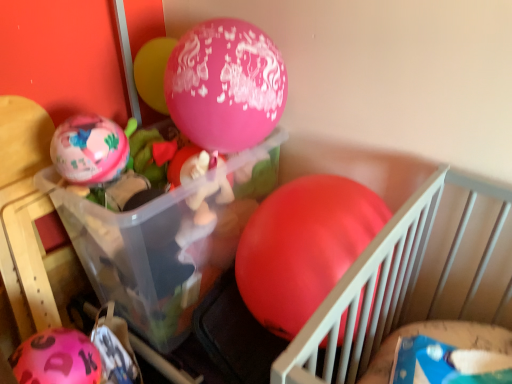
Question: From the image's perspective, does pink matte balloon at lower left, the fourth balloon from the right, appear higher than transparent plastic container at center?

Choices:
 (A) yes
 (B) no

Answer: (B)

Question: From a real-world perspective, is pink matte balloon at lower left, the 1th balloon positioned from the left, physically below transparent plastic container at center?

Choices:
 (A) yes
 (B) no

Answer: (A)

Question: Considering the relative positions of pink matte balloon at lower left, the fourth balloon from the right, and transparent plastic container at center in the image provided, is pink matte balloon at lower left, the fourth balloon from the right, in front of transparent plastic container at center?

Choices:
 (A) yes
 (B) no

Answer: (A)

Question: Does pink matte balloon at lower left, the fourth balloon from the right, appear on the right side of transparent plastic container at center?

Choices:
 (A) no
 (B) yes

Answer: (A)

Question: Is pink matte balloon at lower left, the 1th balloon positioned from the left, to the left of transparent plastic container at center from the viewer's perspective?

Choices:
 (A) no
 (B) yes

Answer: (B)

Question: In the image, is matte pink balloon at left, which is the third balloon from right to left, on the left side or the right side of transparent plastic container at center?

Choices:
 (A) right
 (B) left

Answer: (B)

Question: In the image, is matte pink balloon at left, placed as the second balloon when sorted from left to right, positioned in front of or behind transparent plastic container at center?

Choices:
 (A) behind
 (B) front

Answer: (A)

Question: Is matte pink balloon at left, which is the third balloon from right to left, taller or shorter than transparent plastic container at center?

Choices:
 (A) tall
 (B) short

Answer: (B)

Question: Considering the positions of point (100, 119) and point (194, 221), is point (100, 119) closer or farther from the camera than point (194, 221)?

Choices:
 (A) closer
 (B) farther

Answer: (A)

Question: Relative to pink matte balloon at lower left, the fourth balloon from the right, is rubber matte balloon at center, which is the first balloon in right-to-left order, in front or behind?

Choices:
 (A) behind
 (B) front

Answer: (B)

Question: Would you say rubber matte balloon at center, positioned as the 4th balloon in left-to-right order, is to the left or to the right of pink matte balloon at lower left, the 1th balloon positioned from the left, in the picture?

Choices:
 (A) right
 (B) left

Answer: (A)

Question: Is rubber matte balloon at center, which is the first balloon in right-to-left order, bigger or smaller than pink matte balloon at lower left, the 1th balloon positioned from the left?

Choices:
 (A) small
 (B) big

Answer: (B)

Question: Does point (245, 297) appear closer or farther from the camera than point (56, 349)?

Choices:
 (A) farther
 (B) closer

Answer: (A)

Question: Is pink matte balloon at lower left, the 1th balloon positioned from the left, inside or outside of pink glossy balloon at upper center, the 2th balloon in the right-to-left sequence?

Choices:
 (A) outside
 (B) inside

Answer: (A)

Question: Considering the positions of point (28, 349) and point (145, 61), is point (28, 349) closer or farther from the camera than point (145, 61)?

Choices:
 (A) closer
 (B) farther

Answer: (A)